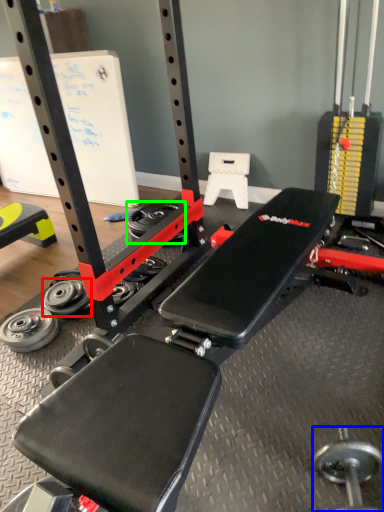
Question: Estimate the real-world distances between objects in this image. Which object is closer to wheel (highlighted by a red box), dumbbell (highlighted by a blue box) or wheel (highlighted by a green box)?

Choices:
 (A) dumbbell
 (B) wheel

Answer: (B)